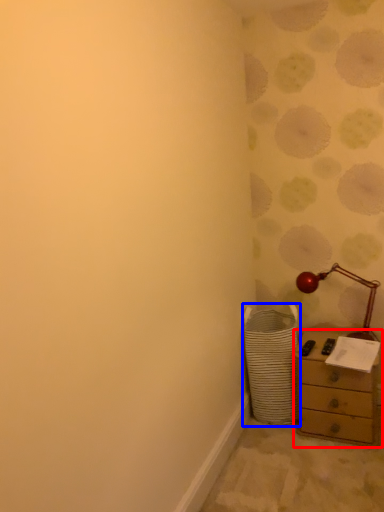
Question: Among these objects, which one is nearest to the camera, chest of drawers (highlighted by a red box) or laundry basket (highlighted by a blue box)?

Choices:
 (A) chest of drawers
 (B) laundry basket

Answer: (A)